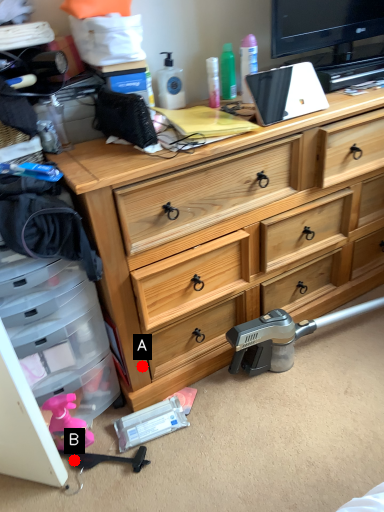
Question: Two points are circled on the image, labeled by A and B beside each circle. Which point is closer to the camera?

Choices:
 (A) A is closer
 (B) B is closer

Answer: (B)